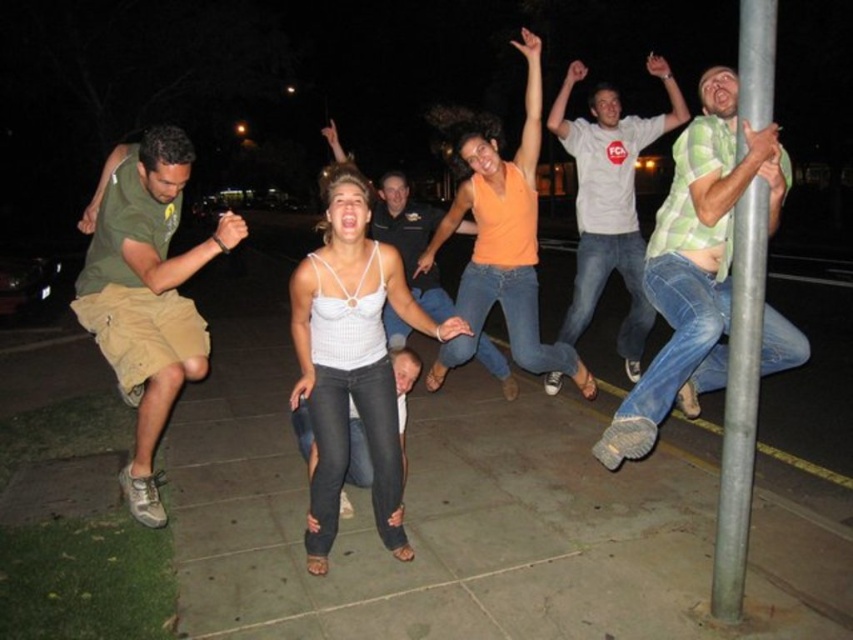
You are standing on the sidewalk and want to take a photo of the group of people in the middle of the scene. Which object, the gray concrete pavement at center or the white knit tank top at center, should you focus on to ensure the people are in sharp focus?

You should focus on the white knit tank top at center because it is closer to the camera than the gray concrete pavement at center, which is further away. Focusing on the white knit tank top at center will keep the people in sharp focus.